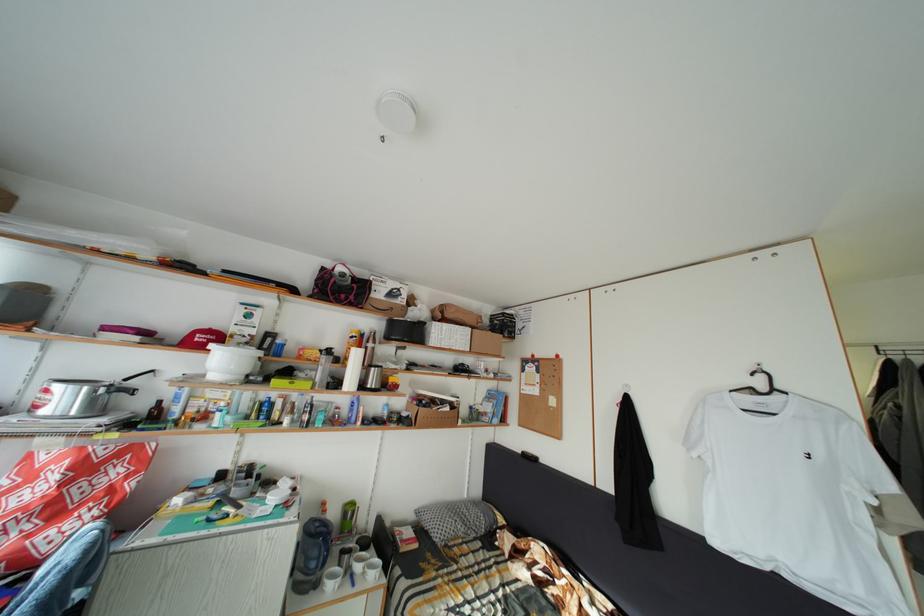
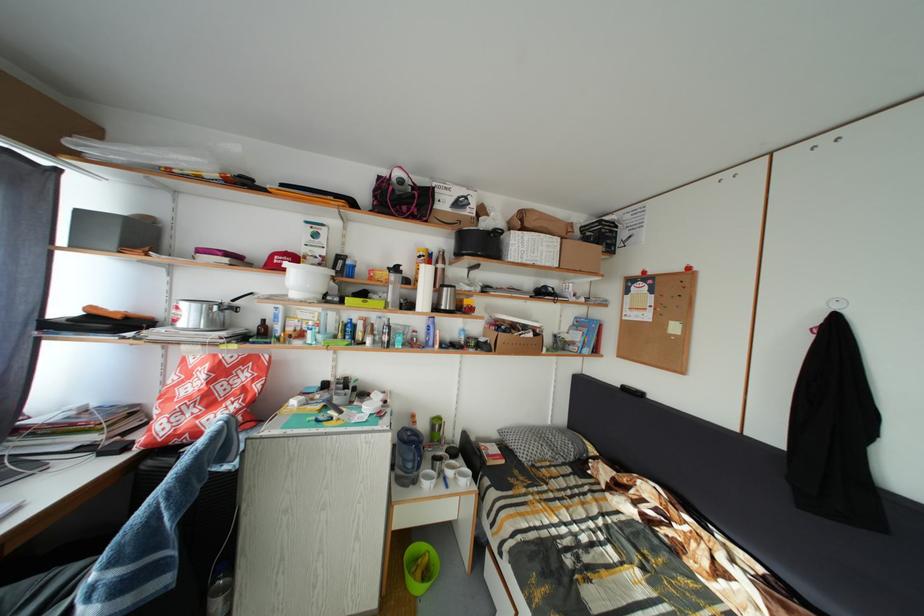
The point at (367, 573) is marked in the first image. Where is the corresponding point in the second image?

(458, 480)